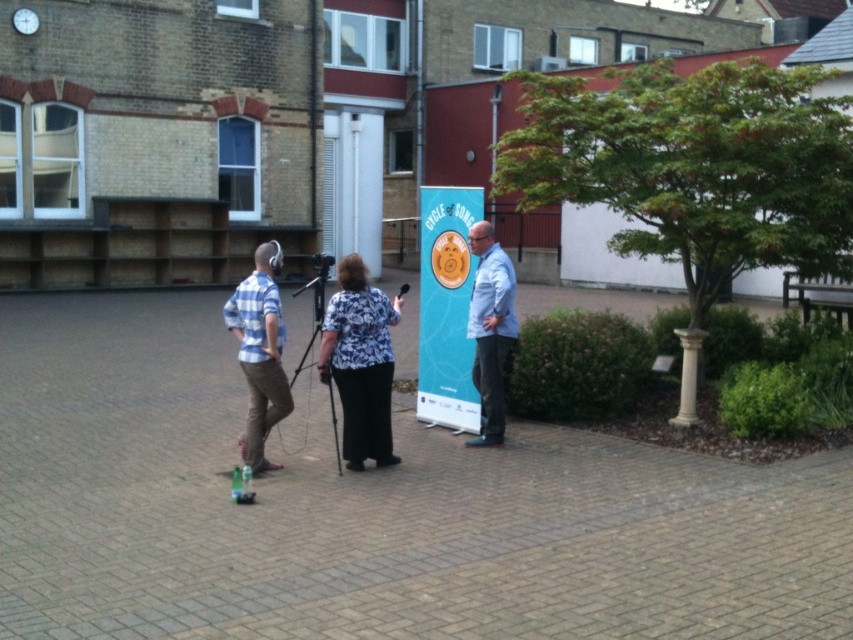
The image size is (853, 640). What do you see at coordinates (491, 330) in the screenshot?
I see `blue shirt at center` at bounding box center [491, 330].

Between blue shirt at center and black matte microphone at center, which one has more height?

With more height is blue shirt at center.

I want to click on blue shirt at center, so click(491, 330).

Who is positioned more to the right, black matte tripod at center or black matte microphone at center?

Positioned to the right is black matte microphone at center.

Which is in front, point (314, 296) or point (398, 296)?

Point (314, 296) is more forward.

This screenshot has height=640, width=853. I want to click on black matte tripod at center, so click(x=312, y=307).

Who is taller, floral blouse at center or black matte tripod at center?

With more height is black matte tripod at center.

Which is in front, point (352, 268) or point (318, 324)?

Point (352, 268) is in front.

This screenshot has height=640, width=853. In order to click on floral blouse at center in this screenshot , I will do [x=360, y=362].